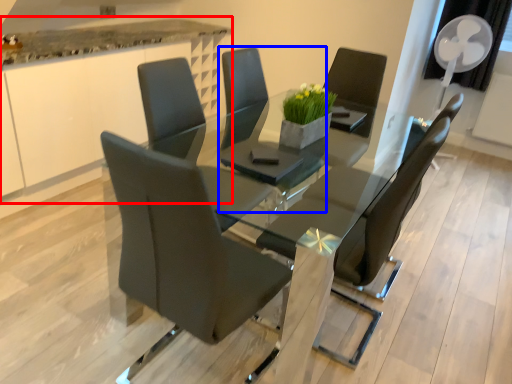
Question: Which of the following is the farthest to the observer, counter (highlighted by a red box) or chair (highlighted by a blue box)?

Choices:
 (A) counter
 (B) chair

Answer: (A)